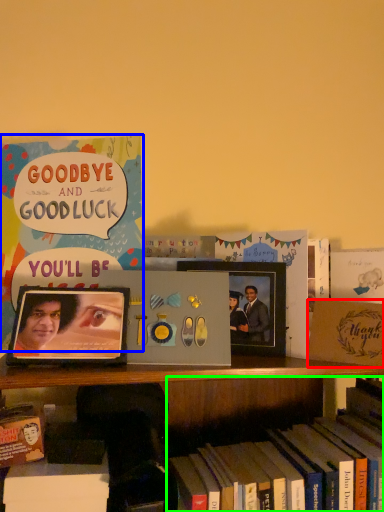
Question: Which is nearer to the paperback book (highlighted by a red box)? book (highlighted by a blue box) or book (highlighted by a green box).

Choices:
 (A) book
 (B) book

Answer: (B)